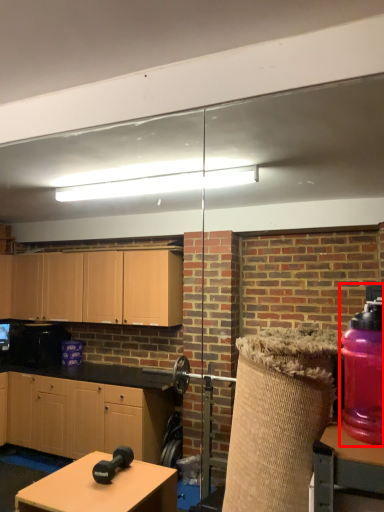
Question: In this image, where is bottle (annotated by the red box) located relative to table?

Choices:
 (A) left
 (B) right

Answer: (B)